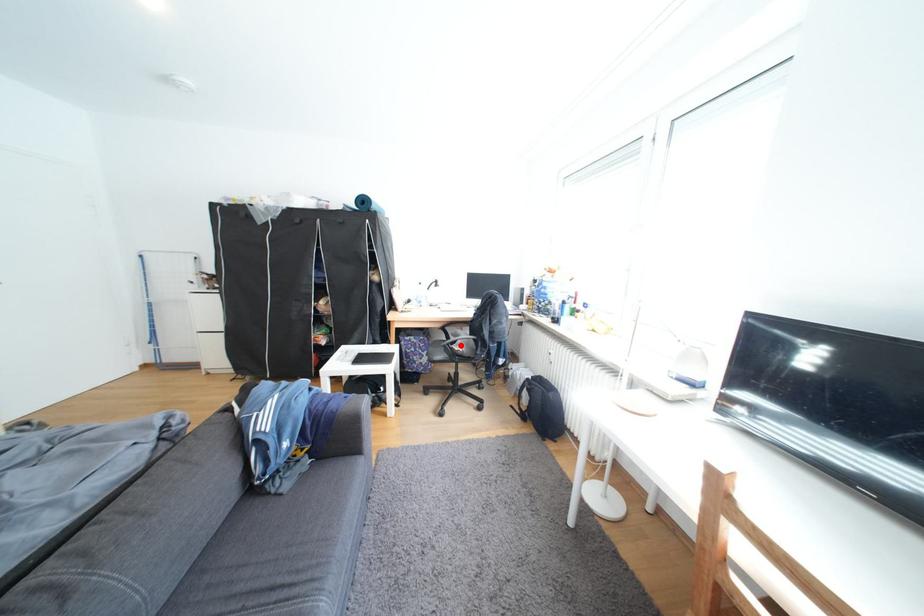
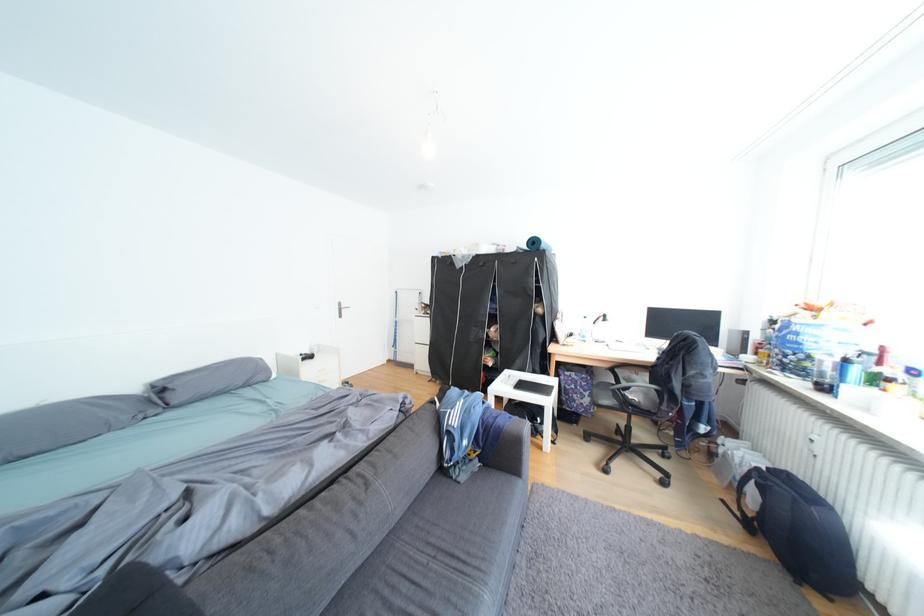
Question: I am providing you with two images of the same scene from different viewpoints. Image1 has a red point marked. In image2, the corresponding 3D location appears at what relative position? Reply with the corresponding letter.

Choices:
 (A) Closer
 (B) Farther

Answer: (A)